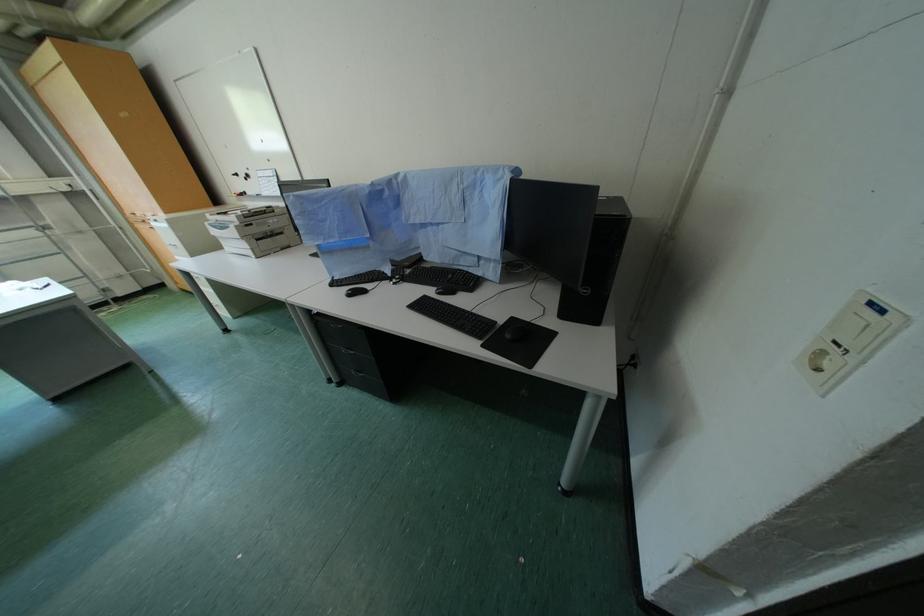
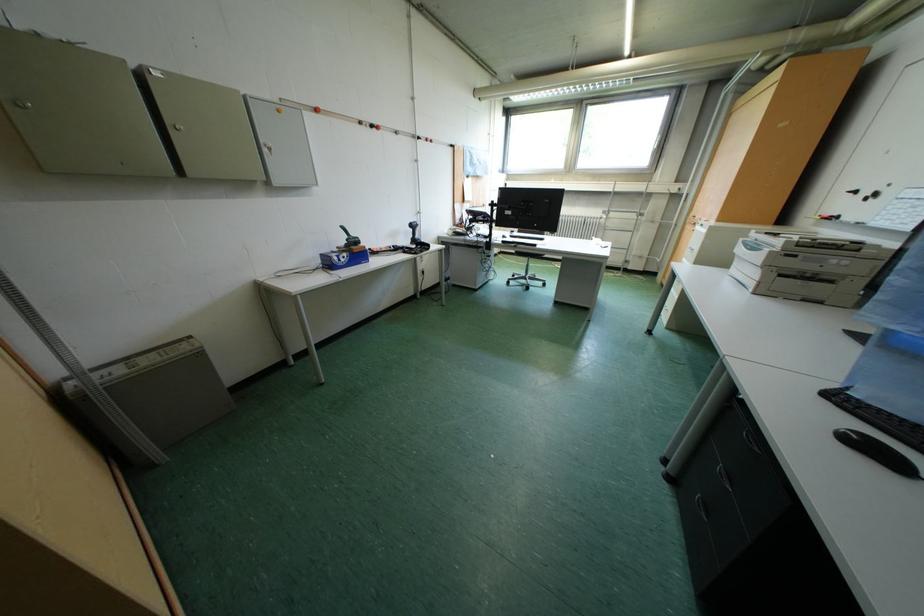
First-person continuous shooting, in which direction is the camera rotating?

The camera's rotation is toward left-down.